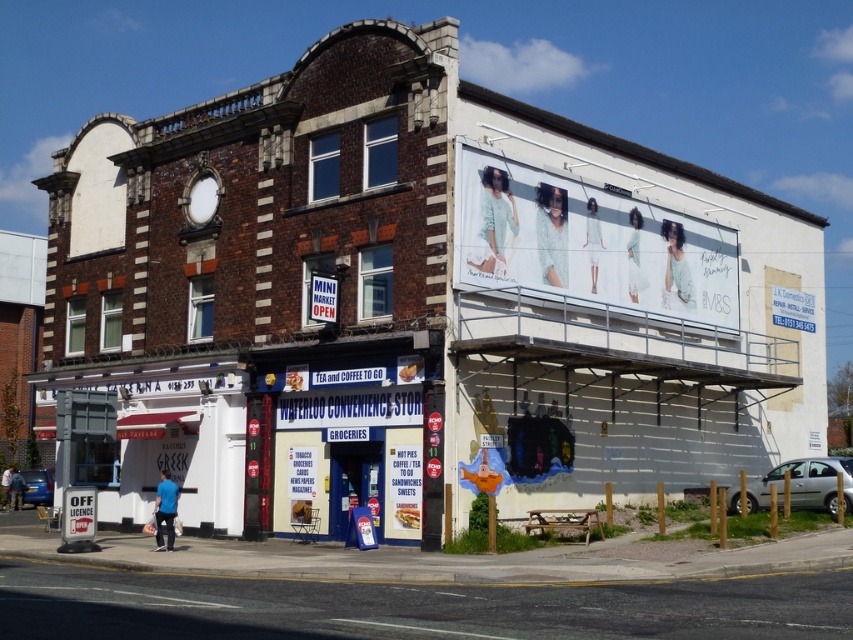
Is silver metallic van at lower right wider than metallic blue sedan at lower left?

No.

Can you confirm if silver metallic van at lower right is thinner than metallic blue sedan at lower left?

Indeed, silver metallic van at lower right has a lesser width compared to metallic blue sedan at lower left.

Which is in front, point (735, 499) or point (51, 484)?

Point (735, 499) is in front.

I want to click on silver metallic van at lower right, so click(x=804, y=484).